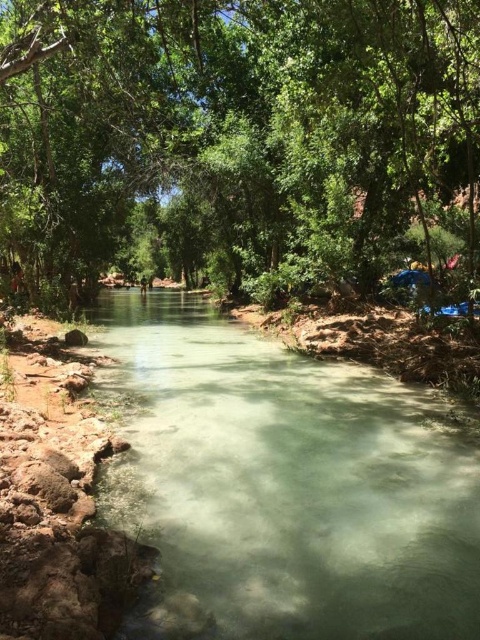
Question: Is green leafy tree at center below clear water at center?

Choices:
 (A) yes
 (B) no

Answer: (B)

Question: Where is green leafy tree at center located in relation to clear water at center in the image?

Choices:
 (A) below
 (B) above

Answer: (B)

Question: Which of the following is the farthest from the observer?

Choices:
 (A) (242, 404)
 (B) (216, 166)

Answer: (B)

Question: Does green leafy tree at center appear on the left side of clear water at center?

Choices:
 (A) yes
 (B) no

Answer: (A)

Question: Among these objects, which one is nearest to the camera?

Choices:
 (A) green leafy tree at center
 (B) clear water at center

Answer: (B)